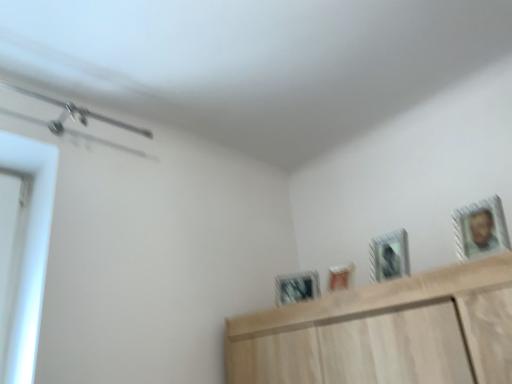
Question: Is matte white picture frame at center, marked as the 2th picture frame in a back-to-front arrangement, positioned with its back to metallic silver picture frame at upper right, which is counted as the 1th picture frame, starting from the front?

Choices:
 (A) yes
 (B) no

Answer: (B)

Question: Is metallic silver picture frame at upper right, which appears as the 4th picture frame when viewed from the left, located within matte white picture frame at center, marked as the 2th picture frame in a back-to-front arrangement?

Choices:
 (A) yes
 (B) no

Answer: (B)

Question: Is the surface of matte white picture frame at center, the third picture frame in the front-to-back sequence, in direct contact with metallic silver picture frame at upper right, which is counted as the first picture frame, starting from the right?

Choices:
 (A) yes
 (B) no

Answer: (B)

Question: Is matte white picture frame at center, which ranks as the second picture frame in left-to-right order, at the left side of metallic silver picture frame at upper right, which is counted as the 1th picture frame, starting from the front?

Choices:
 (A) no
 (B) yes

Answer: (B)

Question: Is matte white picture frame at center, which is counted as the 3th picture frame, starting from the right, shorter than metallic silver picture frame at upper right, the 4th picture frame from the back?

Choices:
 (A) no
 (B) yes

Answer: (B)

Question: In terms of width, does metallic silver picture frame at upper center, marked as the 2th picture frame in a right-to-left arrangement, look wider or thinner when compared to metallic silver picture frame at upper right, which is counted as the 1th picture frame, starting from the front?

Choices:
 (A) thin
 (B) wide

Answer: (A)

Question: Relative to metallic silver picture frame at upper right, which is counted as the 1th picture frame, starting from the front, is metallic silver picture frame at upper center, positioned as the third picture frame in left-to-right order, in front or behind?

Choices:
 (A) behind
 (B) front

Answer: (A)

Question: From a real-world perspective, is metallic silver picture frame at upper center, positioned as the third picture frame in left-to-right order, positioned above or below metallic silver picture frame at upper right, which is counted as the 1th picture frame, starting from the front?

Choices:
 (A) below
 (B) above

Answer: (A)

Question: In terms of height, does metallic silver picture frame at upper center, positioned as the third picture frame in left-to-right order, look taller or shorter compared to metallic silver picture frame at upper right, which is counted as the 1th picture frame, starting from the front?

Choices:
 (A) short
 (B) tall

Answer: (B)

Question: Considering the positions of matte white picture frame at center, which ranks as the second picture frame in left-to-right order, and metallic silver picture frame at center, which ranks as the first picture frame in back-to-front order, in the image, is matte white picture frame at center, which ranks as the second picture frame in left-to-right order, taller or shorter than metallic silver picture frame at center, which ranks as the first picture frame in back-to-front order,?

Choices:
 (A) tall
 (B) short

Answer: (B)

Question: Is matte white picture frame at center, which ranks as the second picture frame in left-to-right order, inside or outside of metallic silver picture frame at center, positioned as the fourth picture frame in right-to-left order?

Choices:
 (A) inside
 (B) outside

Answer: (B)

Question: From the image's perspective, relative to metallic silver picture frame at center, positioned as the fourth picture frame in right-to-left order, is matte white picture frame at center, the third picture frame in the front-to-back sequence, above or below?

Choices:
 (A) below
 (B) above

Answer: (B)

Question: From a real-world perspective, is matte white picture frame at center, which ranks as the second picture frame in left-to-right order, above or below metallic silver picture frame at center, positioned as the fourth picture frame in right-to-left order?

Choices:
 (A) below
 (B) above

Answer: (A)

Question: From their relative heights in the image, would you say metallic silver picture frame at upper right, which is counted as the 1th picture frame, starting from the front, is taller or shorter than matte white picture frame at center, marked as the 2th picture frame in a back-to-front arrangement?

Choices:
 (A) tall
 (B) short

Answer: (A)

Question: From the image's perspective, is metallic silver picture frame at upper right, which is counted as the 1th picture frame, starting from the front, above or below matte white picture frame at center, which ranks as the second picture frame in left-to-right order?

Choices:
 (A) below
 (B) above

Answer: (B)